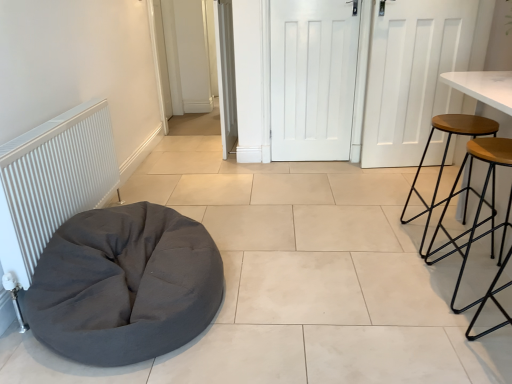
What are the coordinates of `vacant region to the left of wooden seat stool at right, which is the first stool in front-to-back order` in the screenshot? It's located at (404, 288).